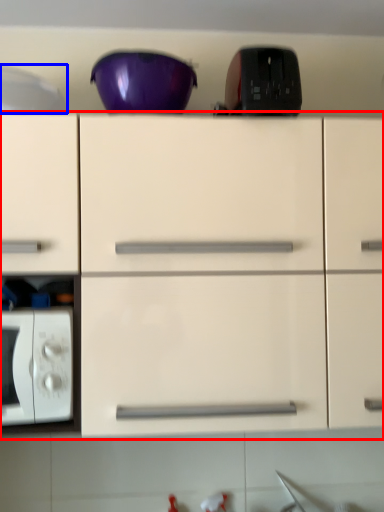
Question: Which point is closer to the camera, cabinetry (highlighted by a red box) or appliance (highlighted by a blue box)?

Choices:
 (A) cabinetry
 (B) appliance

Answer: (A)